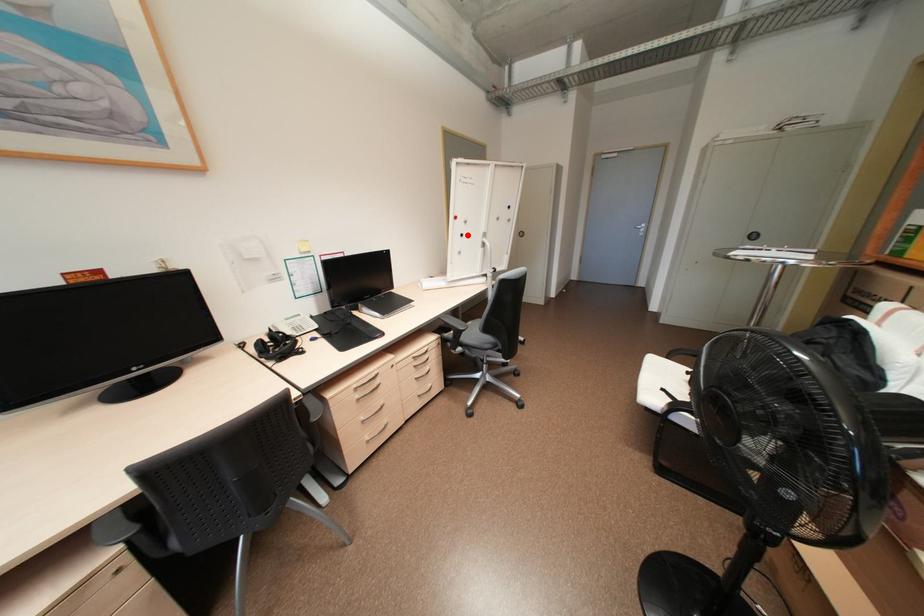
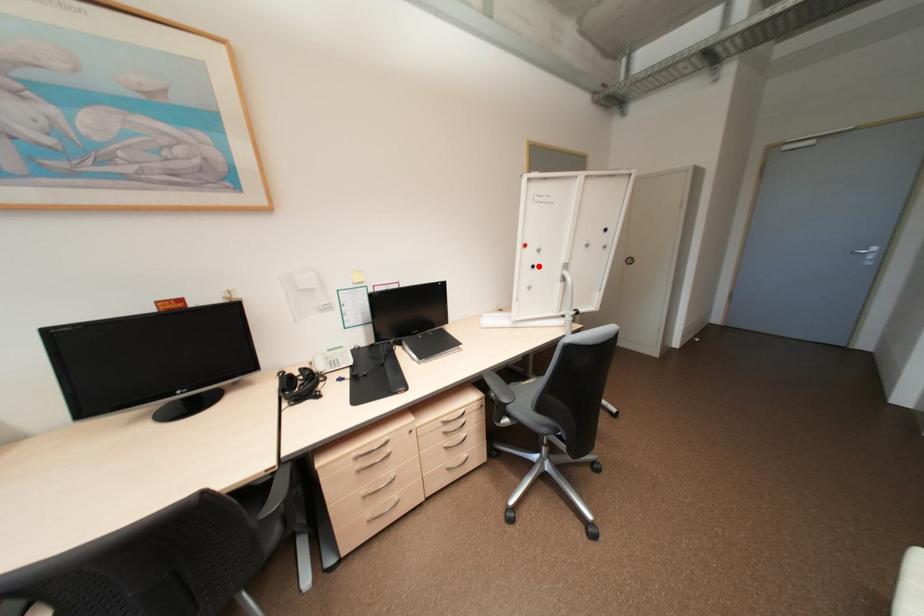
I am providing you with two images of the same scene from different viewpoints. A red point is marked on the first image and another point is marked on the second image. Are the points marked in image1 and image2 representing the same 3D position?

Yes